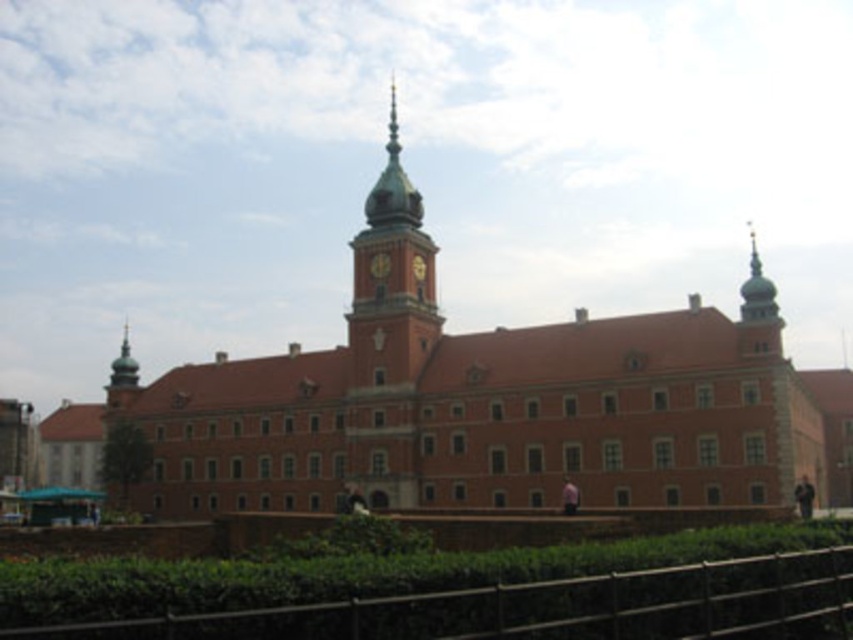
Can you confirm if brown wooden fence at lower center is thinner than golden metallic clock at center?

No, brown wooden fence at lower center is not thinner than golden metallic clock at center.

Where is `brown wooden fence at lower center`? This screenshot has width=853, height=640. brown wooden fence at lower center is located at coordinates (532, 605).

What do you see at coordinates (532, 605) in the screenshot?
I see `brown wooden fence at lower center` at bounding box center [532, 605].

You are a GUI agent. You are given a task and a screenshot of the screen. Output one action in this format:
    pyautogui.click(x=<x>, y=<y>)
    Task: Click on the brown wooden fence at lower center
    This screenshot has height=640, width=853.
    Given the screenshot: What is the action you would take?
    pyautogui.click(x=532, y=605)

Does gold metallic clock at center lie in front of golden metallic clock at center?

Yes, gold metallic clock at center is closer to the viewer.

Is gold metallic clock at center behind golden metallic clock at center?

No.

Who is more distant from viewer, (381, 253) or (422, 266)?

Point (422, 266)

You are a GUI agent. You are given a task and a screenshot of the screen. Output one action in this format:
    pyautogui.click(x=<x>, y=<y>)
    Task: Click on the gold metallic clock at center
    This screenshot has height=640, width=853.
    Given the screenshot: What is the action you would take?
    pyautogui.click(x=379, y=266)

Which of these two, brown wooden fence at lower center or gold metallic clock at center, stands taller?

Standing taller between the two is brown wooden fence at lower center.

Does brown wooden fence at lower center lie behind gold metallic clock at center?

No, it is in front of gold metallic clock at center.

Where is `brown wooden fence at lower center`? The image size is (853, 640). brown wooden fence at lower center is located at coordinates (532, 605).

The width and height of the screenshot is (853, 640). In order to click on brown wooden fence at lower center in this screenshot , I will do `click(532, 605)`.